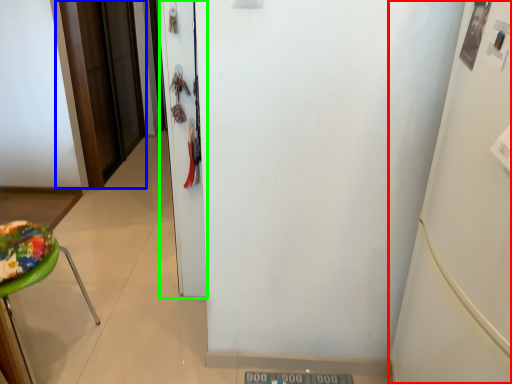
Question: Which is farther away from fridge (highlighted by a red box)? door (highlighted by a blue box) or door (highlighted by a green box)?

Choices:
 (A) door
 (B) door

Answer: (A)